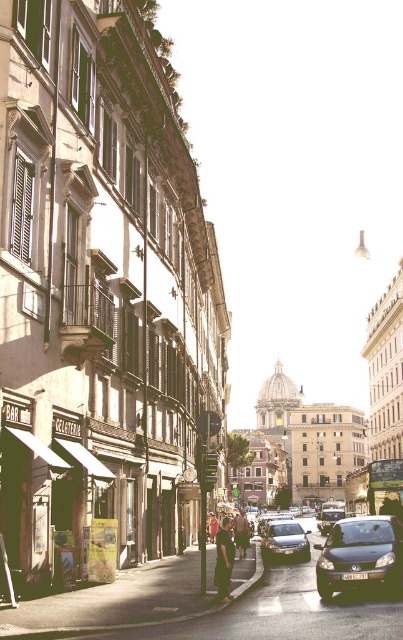
Who is higher up, satin silver sedan at center or dark blue jeans at center?

dark blue jeans at center is higher up.

Can you confirm if satin silver sedan at center is positioned above dark blue jeans at center?

Actually, satin silver sedan at center is below dark blue jeans at center.

Who is more distant from viewer, (270, 557) or (247, 522)?

The point (247, 522) is behind.

This screenshot has height=640, width=403. I want to click on satin silver sedan at center, so click(x=284, y=541).

Can you confirm if matte black car at lower right is positioned above dark blue jeans at center?

Correct, matte black car at lower right is located above dark blue jeans at center.

Is matte black car at lower right below dark blue jeans at center?

Incorrect, matte black car at lower right is not positioned below dark blue jeans at center.

Between point (359, 579) and point (243, 540), which one is positioned behind?

The point (243, 540) is behind.

Identify the location of matte black car at lower right. The image size is (403, 640). (361, 554).

In the scene shown: Is satin silver sedan at center taller than shiny silver car at center?

Incorrect, satin silver sedan at center's height is not larger of shiny silver car at center's.

Is satin silver sedan at center shorter than shiny silver car at center?

Yes, satin silver sedan at center is shorter than shiny silver car at center.

Who is more distant from viewer, (301, 538) or (328, 520)?

Positioned behind is point (328, 520).

What are the coordinates of `satin silver sedan at center` in the screenshot? It's located at (284, 541).